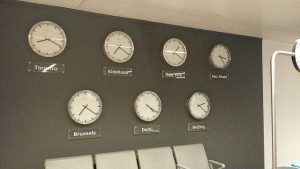
You are a GUI agent. You are given a task and a screenshot of the screen. Output one action in this format:
    pyautogui.click(x=<x>, y=<y>)
    Task: Click on the white wall
    The width and height of the screenshot is (300, 169).
    Given the screenshot: What is the action you would take?
    pyautogui.click(x=286, y=105)